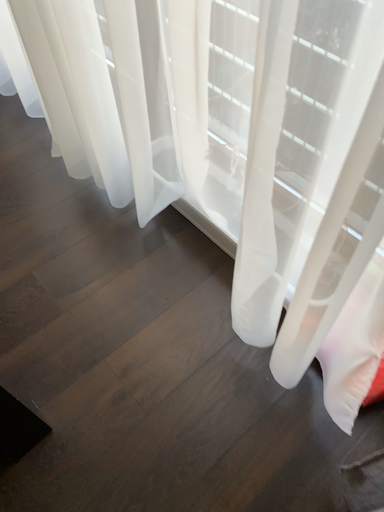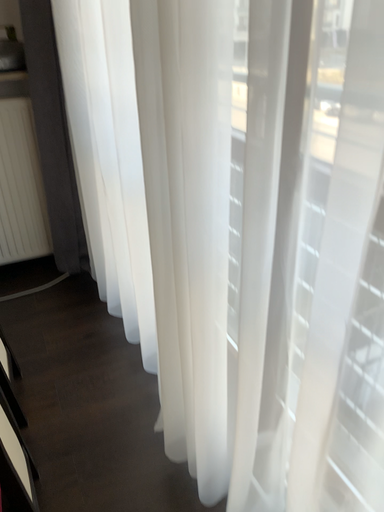
Question: How did the camera likely rotate when shooting the video?

Choices:
 (A) rotated left
 (B) rotated right

Answer: (A)